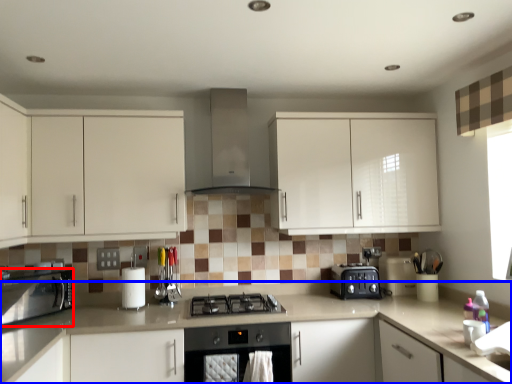
Question: Which object appears farthest to the camera in this image, kitchen appliance (highlighted by a red box) or countertop (highlighted by a blue box)?

Choices:
 (A) kitchen appliance
 (B) countertop

Answer: (A)